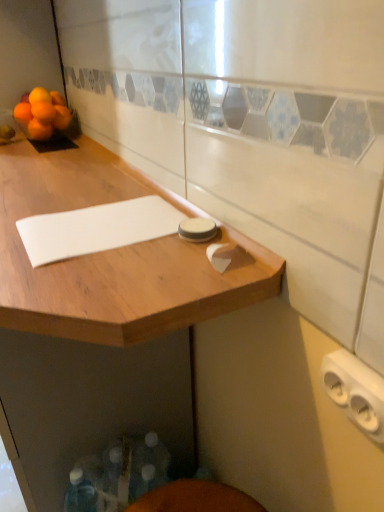
Question: From the image's perspective, is white matte notepad at center above orange matte at upper left, which is counted as the 3th orange, starting from the left?

Choices:
 (A) no
 (B) yes

Answer: (A)

Question: Is white matte notepad at center facing towards orange matte at upper left, which is the second orange in right-to-left order?

Choices:
 (A) no
 (B) yes

Answer: (A)

Question: Is white matte notepad at center placed right next to orange matte at upper left, which is the second orange in right-to-left order?

Choices:
 (A) no
 (B) yes

Answer: (A)

Question: Is white matte notepad at center behind orange matte at upper left, which is counted as the 3th orange, starting from the left?

Choices:
 (A) yes
 (B) no

Answer: (B)

Question: From a real-world perspective, is white matte notepad at center beneath orange matte at upper left, which is counted as the 3th orange, starting from the left?

Choices:
 (A) yes
 (B) no

Answer: (A)

Question: From the image's perspective, would you say white matte notepad at center is shown under orange matte at upper left, which is counted as the 3th orange, starting from the left?

Choices:
 (A) yes
 (B) no

Answer: (A)

Question: Can you confirm if orange matte at left, arranged as the fourth orange when viewed from the right, is smaller than orange matte at upper left, which is counted as the 3th orange, starting from the left?

Choices:
 (A) no
 (B) yes

Answer: (A)

Question: Is orange matte at left, arranged as the fourth orange when viewed from the right, positioned before orange matte at upper left, which is the second orange in right-to-left order?

Choices:
 (A) yes
 (B) no

Answer: (A)

Question: From the image's perspective, is orange matte at left, positioned as the first orange in left-to-right order, over orange matte at upper left, which is counted as the 3th orange, starting from the left?

Choices:
 (A) no
 (B) yes

Answer: (A)

Question: Is orange matte at left, positioned as the first orange in left-to-right order, bigger than orange matte at upper left, which is the second orange in right-to-left order?

Choices:
 (A) yes
 (B) no

Answer: (A)

Question: Would you consider orange matte at left, arranged as the fourth orange when viewed from the right, to be distant from orange matte at upper left, which is the second orange in right-to-left order?

Choices:
 (A) no
 (B) yes

Answer: (A)

Question: From a real-world perspective, is orange matte at left, positioned as the first orange in left-to-right order, below orange matte at upper left, which is the second orange in right-to-left order?

Choices:
 (A) no
 (B) yes

Answer: (B)

Question: Is the position of orange matte at left, arranged as the fourth orange when viewed from the right, less distant than that of orange matte at upper left, the 4th orange in the left-to-right sequence?

Choices:
 (A) no
 (B) yes

Answer: (A)